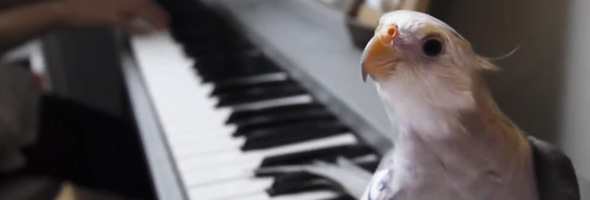
Find the location of `keyboard instrument`. keyboard instrument is located at coordinates (185, 77).